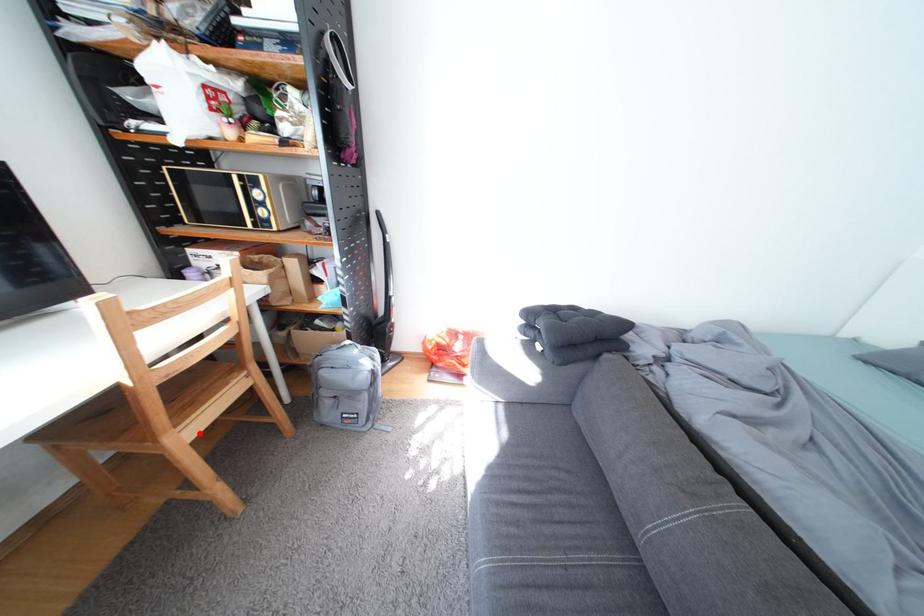
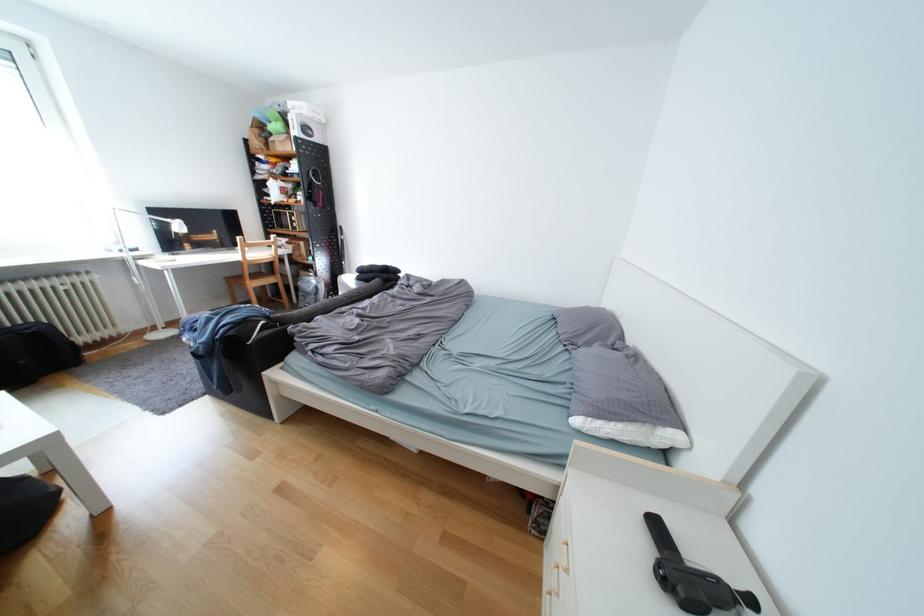
Locate, in the second image, the point that corresponds to the highlighted location in the first image.

(265, 285)